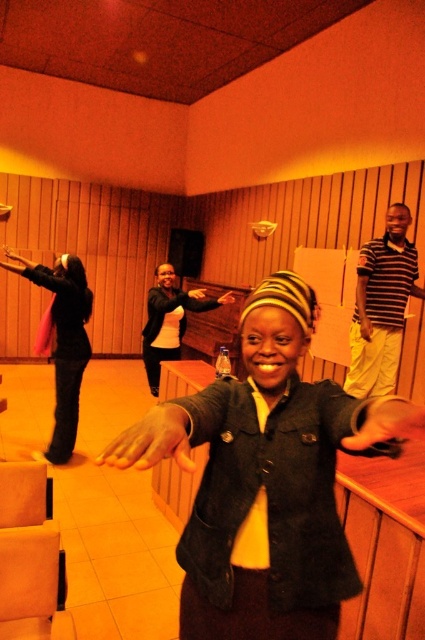
Question: Is denim jacket at center below matte black jacket at left?

Choices:
 (A) yes
 (B) no

Answer: (A)

Question: Which of the following is the farthest from the observer?

Choices:
 (A) (275, 280)
 (B) (76, 413)

Answer: (B)

Question: Does denim jacket at center appear on the left side of matte black jacket at left?

Choices:
 (A) no
 (B) yes

Answer: (A)

Question: Does denim jacket at center have a greater width compared to matte black jacket at left?

Choices:
 (A) no
 (B) yes

Answer: (A)